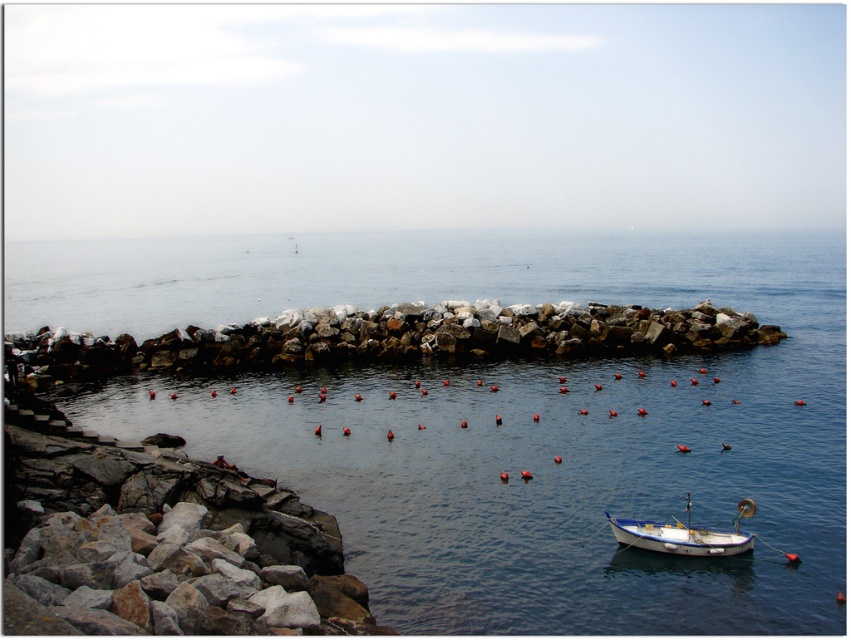
You are standing on the rocky jetty and want to place a small marker at point A and point B. If point A is point (652,346) and point B is point (684,548), which point is closer to you when you are facing the sea?

Point A at (652,346) is closer to you because it is further to the viewer than point B at (684,548).

You are a sailor planning to dock your boat at the blue polished wood boat at lower right. The rockyrough stonerocky barrier at center is in your path. Can you safely navigate around it without hitting the barrier?

The rockyrough stonerocky barrier at center might be wider than the blue polished wood boat at lower right, so there is a possibility of collision if the boat is narrower than the barrier. You should proceed with caution and consider alternative routes to ensure safe passage.

You are a marine biologist studying the coastal ecosystem. You need to place a 40 meter long research net between the blue water at center and the rockyrough stonerocky barrier at center. Will the net fit between them?

The blue water at center and rockyrough stonerocky barrier at center are 39.27 meters apart from each other. Since the net is 40 meters long, it will not fit between them as the distance is slightly shorter than the net.